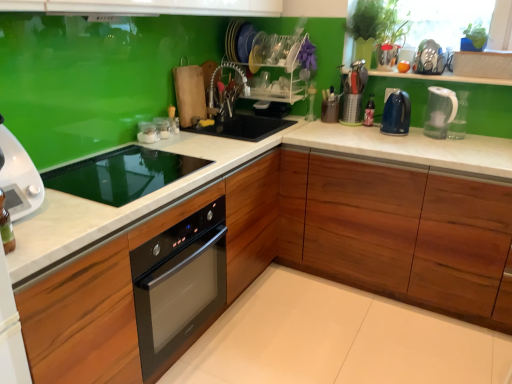
The image size is (512, 384). I want to click on vacant space to the right of clear glass jars at center, which is counted as the 3th appliance, starting from the left, so click(191, 139).